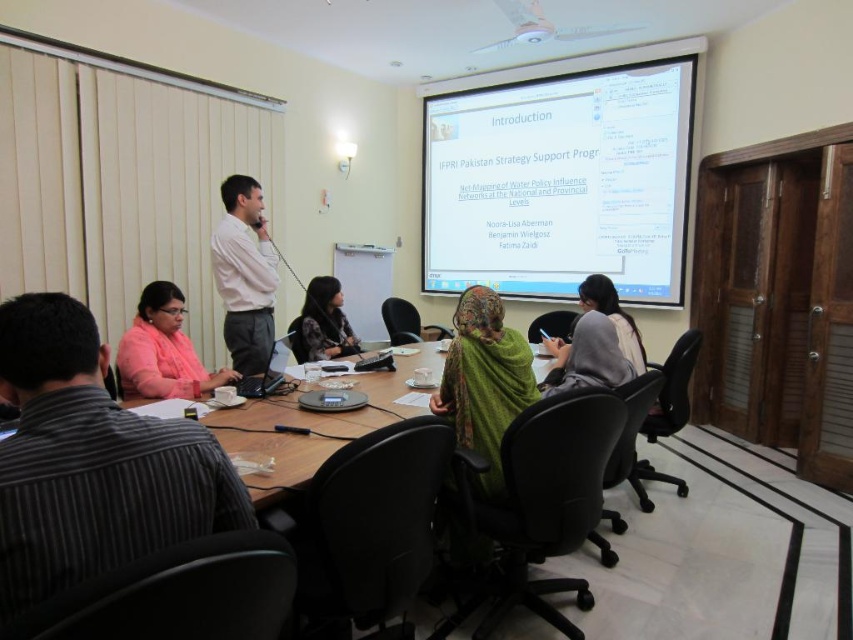
Does matte pink sweater at lower left appear on the right side of dark brown leather jacket at center?

Incorrect, matte pink sweater at lower left is not on the right side of dark brown leather jacket at center.

Describe the element at coordinates (163, 349) in the screenshot. I see `matte pink sweater at lower left` at that location.

Find the location of `matte pink sweater at lower left`. matte pink sweater at lower left is located at coordinates (163, 349).

Is striped shirt at lower left taller than green fabric headscarf at center?

In fact, striped shirt at lower left may be shorter than green fabric headscarf at center.

In the scene shown: Between striped shirt at lower left and green fabric headscarf at center, which one appears on the right side from the viewer's perspective?

green fabric headscarf at center

Locate an element on the screen. The image size is (853, 640). striped shirt at lower left is located at coordinates [91, 461].

Based on the photo, how distant is white shirt at center from gray fabric jacket at center?

The distance of white shirt at center from gray fabric jacket at center is 1.90 meters.

Is white shirt at center thinner than gray fabric jacket at center?

Yes, white shirt at center is thinner than gray fabric jacket at center.

Who is more forward, (239, 356) or (608, 305)?

Point (608, 305) is more forward.

Where is `white shirt at center`? Image resolution: width=853 pixels, height=640 pixels. white shirt at center is located at coordinates (244, 275).